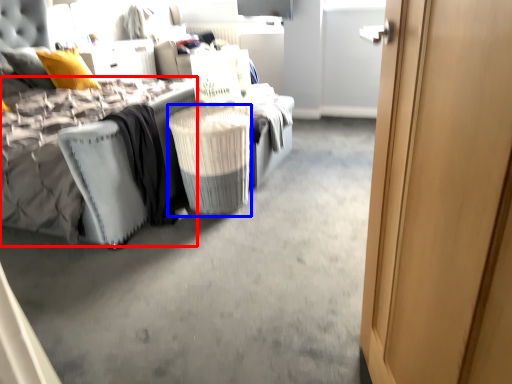
Question: Which object is closer to the camera taking this photo, mattress (highlighted by a red box) or laundry basket (highlighted by a blue box)?

Choices:
 (A) mattress
 (B) laundry basket

Answer: (A)